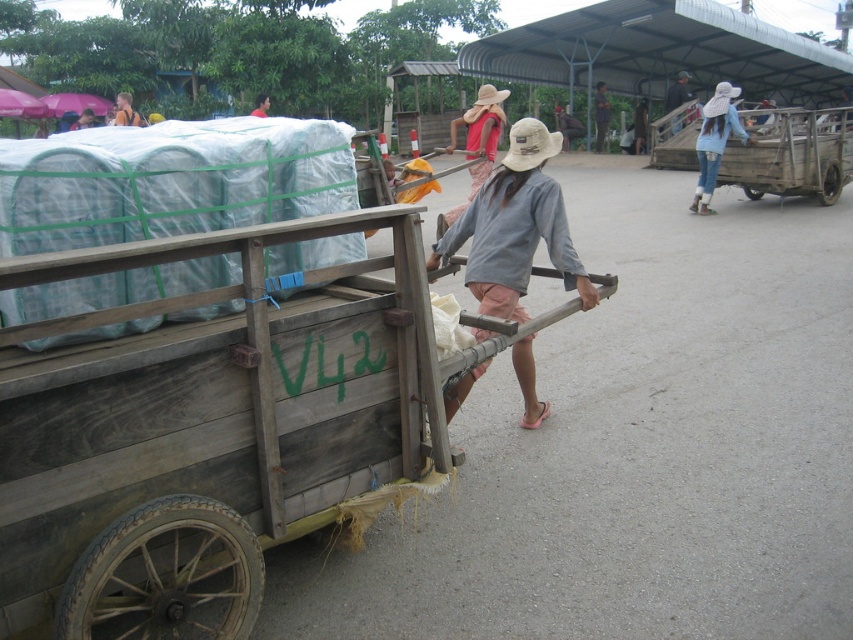
You are a delivery person who needs to choose between the wooden cart at center and the light brown wooden cart at upper left to transport heavy items. Which cart should you choose and why?

You should choose the light brown wooden cart at upper left because it is larger in size compared to the wooden cart at center, making it more suitable for transporting heavy items.

You are standing in front of the cart and want to place a small sticker on the point that is closer to you. Which point should you choose between point (563, 109) and point (115, 102)?

Point (563, 109) is closer to the camera than point (115, 102), so you should place the sticker on point (563, 109).